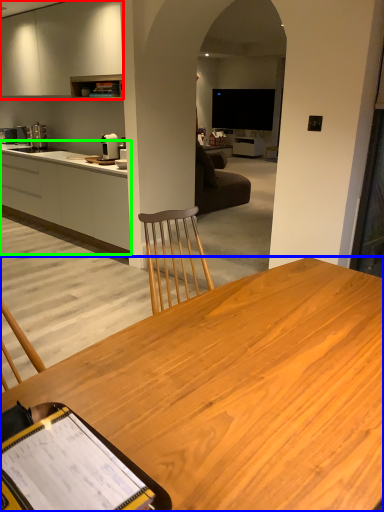
Question: Which object is positioned farthest from cabinetry (highlighted by a red box)? Select from desk (highlighted by a blue box) and cabinetry (highlighted by a green box).

Choices:
 (A) desk
 (B) cabinetry

Answer: (A)